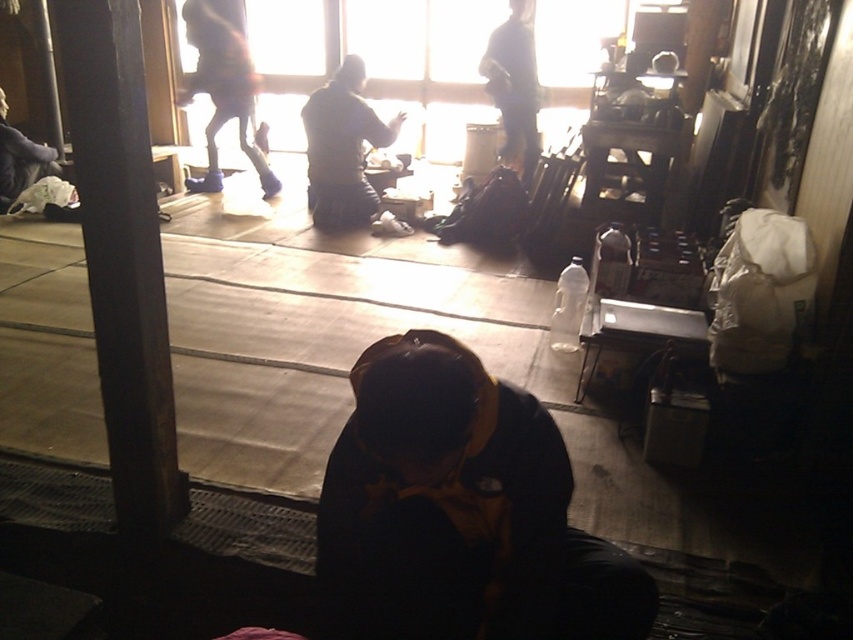
Question: Based on their relative distances, which object is nearer to the dark blue jeans at upper center?

Choices:
 (A) dark yellow fabric at center
 (B) dark gray fabric jacket at center
 (C) dark brown wood pillar at left
 (D) blue fabric pants at upper center

Answer: (B)

Question: Can you confirm if dark brown wood pillar at left is positioned to the left of blue fabric pants at upper center?

Choices:
 (A) yes
 (B) no

Answer: (B)

Question: Is blue fabric pants at upper center positioned at the back of dark blue jeans at upper center?

Choices:
 (A) no
 (B) yes

Answer: (B)

Question: Among these objects, which one is nearest to the camera?

Choices:
 (A) dark brown wood pillar at left
 (B) dark yellow fabric at center
 (C) blue fabric pants at upper center
 (D) dark blue jeans at upper center

Answer: (B)

Question: Which of the following is the farthest from the observer?

Choices:
 (A) (404, 113)
 (B) (485, 68)

Answer: (B)

Question: Where is blue fabric pants at upper center located in relation to dark blue jeans at upper center in the image?

Choices:
 (A) right
 (B) left

Answer: (B)